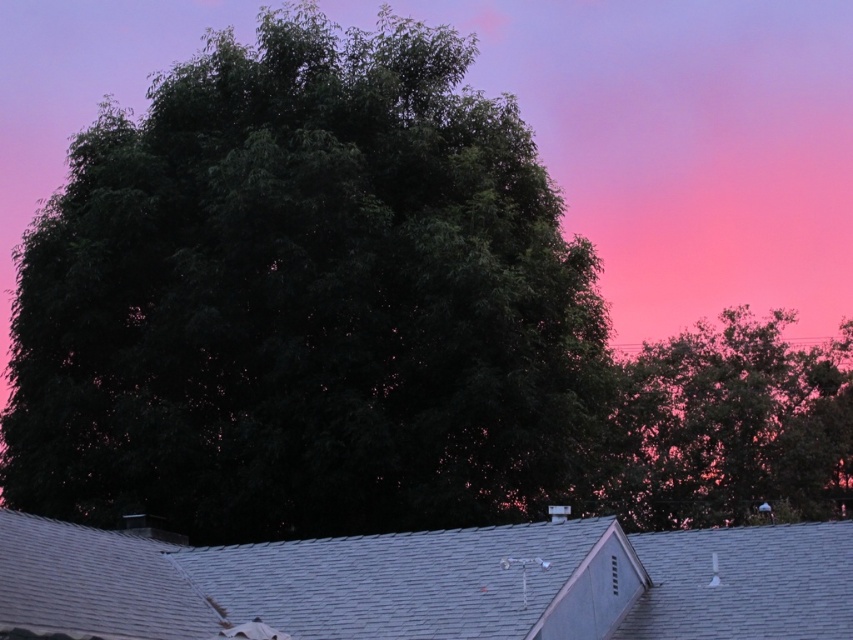
Which of these two, dark green leafy tree at center or gray shingles at center, stands shorter?

gray shingles at center is shorter.

Does point (212, 317) come in front of point (759, 531)?

No.

Where is `dark green leafy tree at center`? The width and height of the screenshot is (853, 640). dark green leafy tree at center is located at coordinates (306, 301).

Which of these two, gray shingles at center or green leafy tree at upper right, stands taller?

green leafy tree at upper right

Who is shorter, gray shingles at center or green leafy tree at upper right?

gray shingles at center

Measure the distance between gray shingles at center and camera.

gray shingles at center is 17.99 meters from camera.

The image size is (853, 640). I want to click on gray shingles at center, so click(431, 582).

Who is shorter, dark green leafy tree at center or green leafy tree at upper right?

Standing shorter between the two is green leafy tree at upper right.

Is point (526, 198) less distant than point (653, 499)?

Yes, it is.

Does point (347, 182) come in front of point (804, 508)?

Yes, it is in front of point (804, 508).

I want to click on dark green leafy tree at center, so click(x=306, y=301).